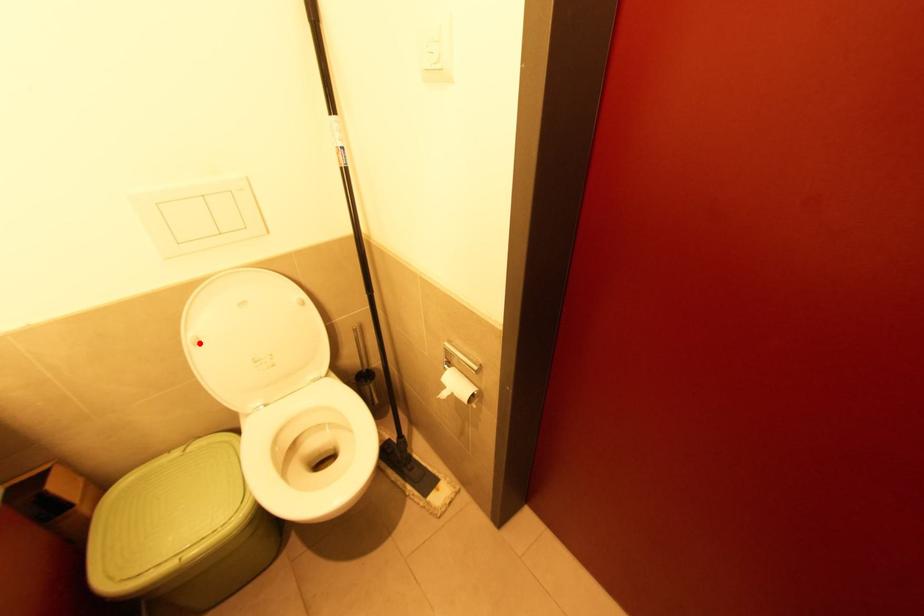
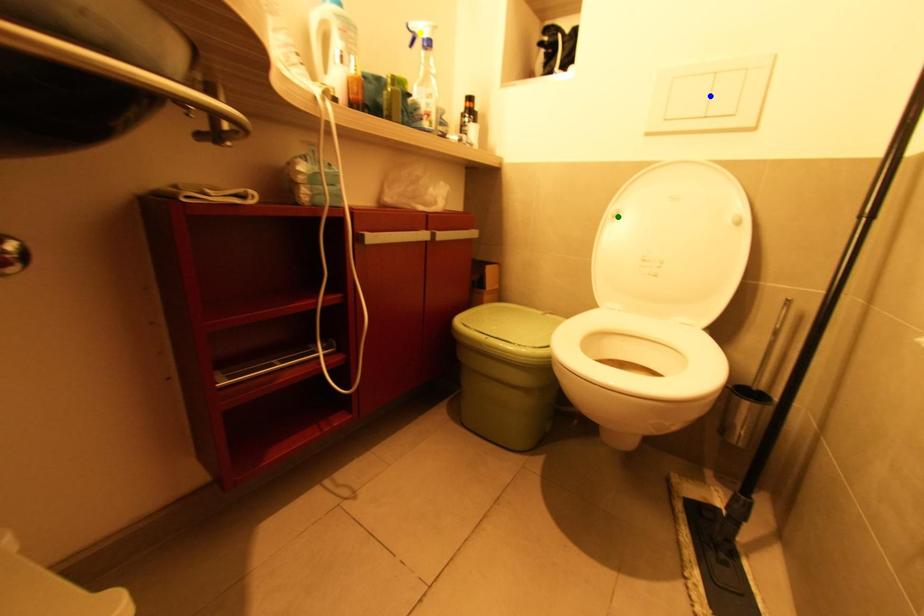
Question: I am providing you with two images of the same scene from different viewpoints. A red point is marked on the first image. You are given multiple points on the second image. Can you choose the point in image 2 that corresponds to the point in image 1?

Choices:
 (A) blue point
 (B) yellow point
 (C) green point

Answer: (C)